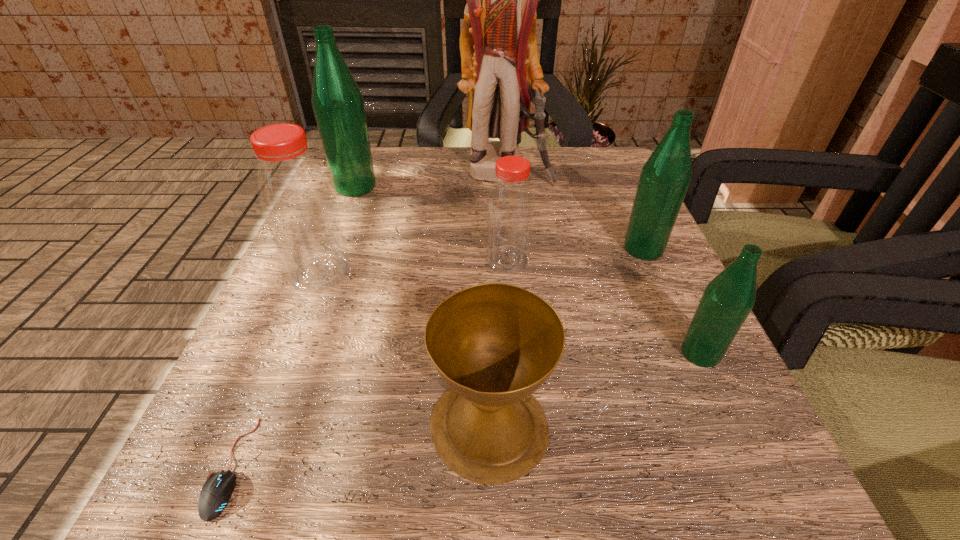
Locate an element on the screen. Image resolution: width=960 pixels, height=540 pixels. red nutcracker is located at coordinates (500, 66).

The height and width of the screenshot is (540, 960). Find the location of `nutcracker`. nutcracker is located at coordinates (500, 66).

This screenshot has height=540, width=960. Identify the location of the leftmost green bottle. (338, 104).

Identify the location of the farthest bottle. (338, 104).

This screenshot has height=540, width=960. I want to click on the bigger red bottle, so click(295, 196).

In order to click on the second farthest green bottle in this screenshot , I will do `click(665, 177)`.

The image size is (960, 540). Find the location of `the smaller red bottle`. the smaller red bottle is located at coordinates (510, 206).

Identify the location of the third bottle from right to left. This screenshot has height=540, width=960. (510, 206).

Where is `the smallest green bottle`? the smallest green bottle is located at coordinates (727, 300).

In order to click on the nearest green bottle in this screenshot , I will do `click(727, 300)`.